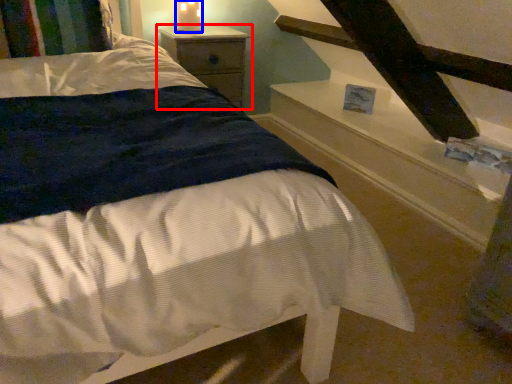
Question: Which object is further to the camera taking this photo, nightstand (highlighted by a red box) or candle holder (highlighted by a blue box)?

Choices:
 (A) nightstand
 (B) candle holder

Answer: (B)